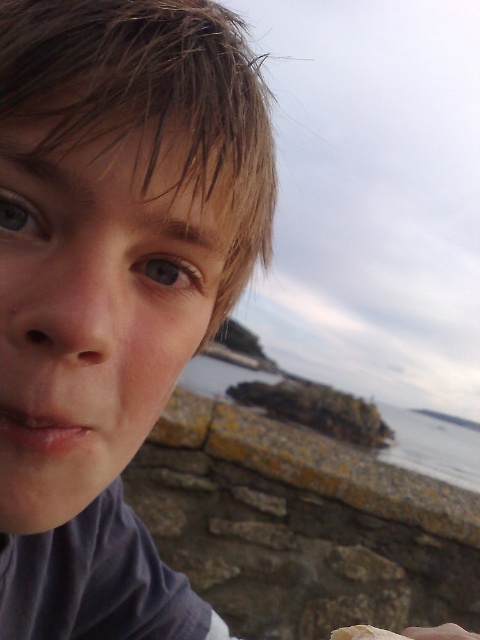
What do you see at coordinates (112, 285) in the screenshot?
I see `matte gray hair at upper left` at bounding box center [112, 285].

Can you confirm if matte gray hair at upper left is taller than smooth skin hand at lower right?

Correct, matte gray hair at upper left is much taller as smooth skin hand at lower right.

Where is `matte gray hair at upper left`? matte gray hair at upper left is located at coordinates (112, 285).

Locate an element on the screen. This screenshot has width=480, height=640. matte gray hair at upper left is located at coordinates (112, 285).

Is matte gray hair at upper left shorter than clear water at lower right?

Correct, matte gray hair at upper left is not as tall as clear water at lower right.

In order to click on matte gray hair at upper left in this screenshot , I will do `click(112, 285)`.

Is point (97, 400) closer to camera compared to point (394, 451)?

That is True.

Where is `matte gray hair at upper left`? The width and height of the screenshot is (480, 640). matte gray hair at upper left is located at coordinates (112, 285).

Does clear water at lower right have a larger size compared to smooth skin hand at lower right?

Correct, clear water at lower right is larger in size than smooth skin hand at lower right.

Which is more to the left, clear water at lower right or smooth skin hand at lower right?

From the viewer's perspective, smooth skin hand at lower right appears more on the left side.

Is point (472, 481) farther from viewer compared to point (478, 634)?

Yes.

This screenshot has height=640, width=480. Identify the location of clear water at lower right. (432, 445).